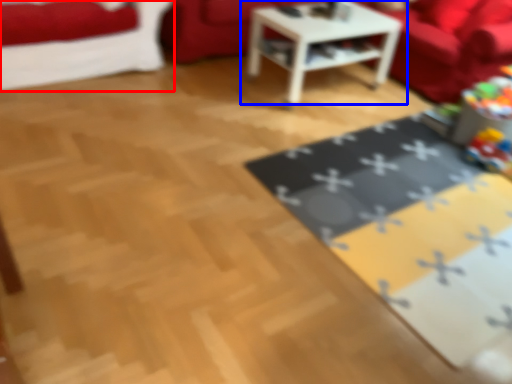
Question: Which of the following is the closest to the observer, studio couch (highlighted by a red box) or table (highlighted by a blue box)?

Choices:
 (A) studio couch
 (B) table

Answer: (A)